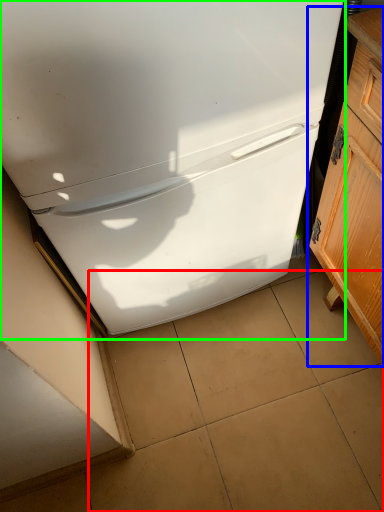
Question: Estimate the real-world distances between objects in this image. Which object is closer to tile (highlighted by a red box), cabinetry (highlighted by a blue box) or refrigerator (highlighted by a green box)?

Choices:
 (A) cabinetry
 (B) refrigerator

Answer: (A)